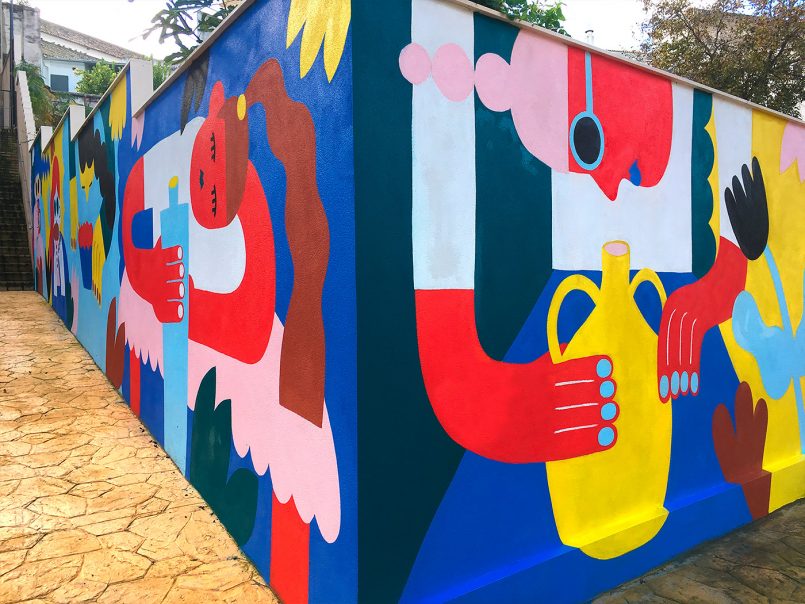
You are a GUI agent. You are given a task and a screenshot of the screen. Output one action in this format:
    pyautogui.click(x=<x>, y=<y>)
    Task: Click on the light brown cobble stone style floor
    This screenshot has height=604, width=805.
    Given the screenshot: What is the action you would take?
    pyautogui.click(x=11, y=469), pyautogui.click(x=753, y=561)